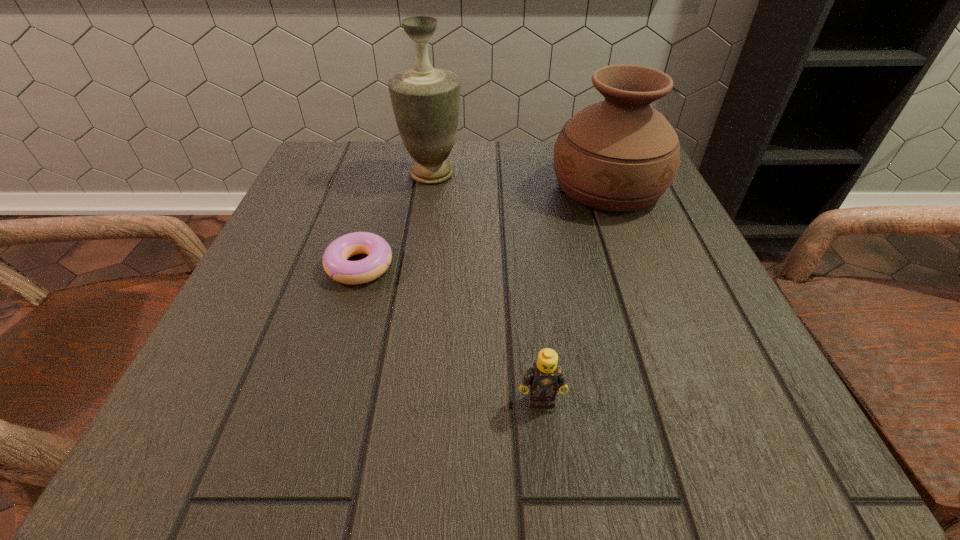
Find the location of a particular element. The image size is (960, 540). free region located on the back of the third farthest object is located at coordinates (384, 181).

The image size is (960, 540). In order to click on object that is at the near edge in this screenshot , I will do `click(544, 376)`.

Where is `object located in the left edge section of the desktop`? This screenshot has height=540, width=960. object located in the left edge section of the desktop is located at coordinates (335, 263).

I want to click on object that is positioned at the right edge, so click(620, 154).

You are a GUI agent. You are given a task and a screenshot of the screen. Output one action in this format:
    pyautogui.click(x=<x>, y=<y>)
    Task: Click on the object that is at the far right corner
    The width and height of the screenshot is (960, 540).
    Given the screenshot: What is the action you would take?
    pyautogui.click(x=620, y=154)

In order to click on vacant area at the far edge in this screenshot , I will do `click(453, 150)`.

At what (x,y) coordinates should I click in order to perform the action: click on vacant space at the near edge. Please return your answer as a coordinate pair (x, y). The image size is (960, 540). Looking at the image, I should click on (420, 402).

The height and width of the screenshot is (540, 960). In the image, there is a desktop. What are the coordinates of `vacant space at the left edge` in the screenshot? It's located at tap(294, 290).

This screenshot has height=540, width=960. I want to click on free space at the right edge of the desktop, so click(x=743, y=368).

The image size is (960, 540). Identify the location of free space at the far left corner. (376, 148).